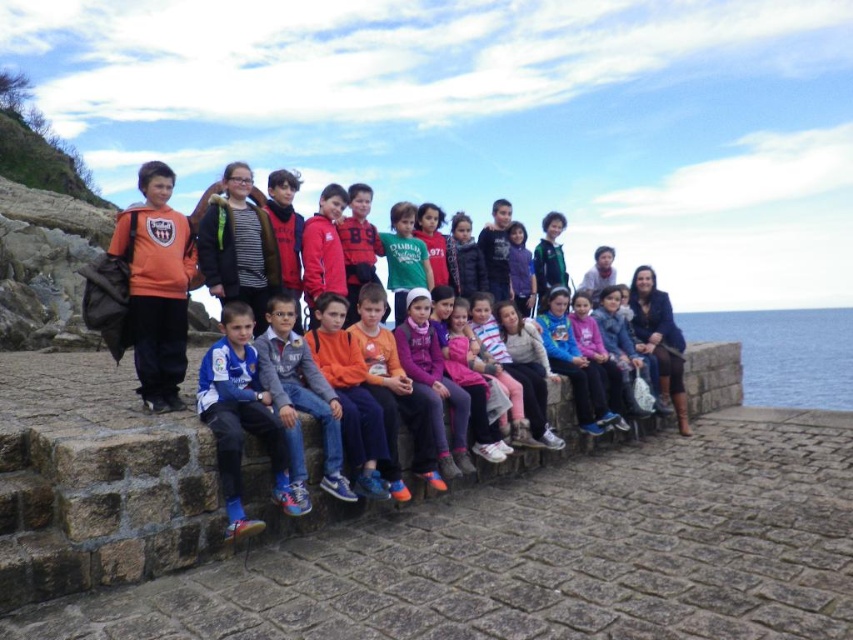
You are a photographer trying to capture a photo of the orange fleece jacket at left and the blue water at lower right. Based on their positions, which object is closer to the camera?

The orange fleece jacket at left is closer to the camera because it is not as tall as the blue water at lower right, indicating it occupies more space in the frame due to its proximity.

You are standing in the coastal area where the photo was taken. You need to locate the orange fleece jacket at left. According to the coordinates provided, where would you look to find it?

The orange fleece jacket at left is located at the 2D coordinates point (157, 285).

You are a photographer taking a picture of the group on the stone wall. You notice two points marked on the wall at coordinates point [172,289] and point [792,400]. Which point should you focus on to ensure the subject in front of it is clearer?

Point [172,289] is closer to the camera than point [792,400], so focusing on point [172,289] will ensure the subject in front of it is clearer.